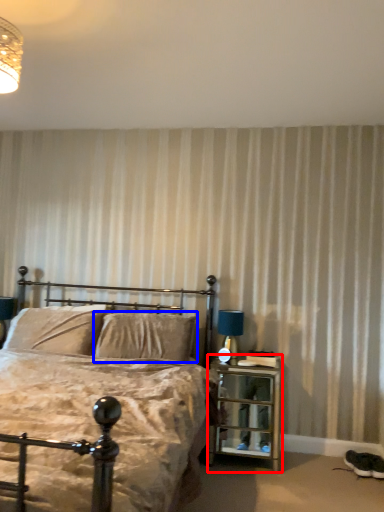
Question: Which object is further to the camera taking this photo, nightstand (highlighted by a red box) or pillow (highlighted by a blue box)?

Choices:
 (A) nightstand
 (B) pillow

Answer: (B)